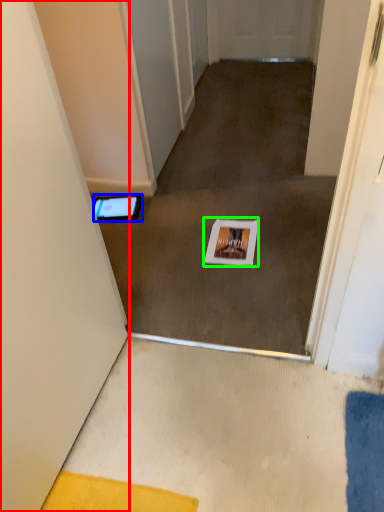
Question: Considering the real-world distances, which object is closest to door (highlighted by a red box)? tablet computer (highlighted by a blue box) or postcard (highlighted by a green box).

Choices:
 (A) tablet computer
 (B) postcard

Answer: (B)